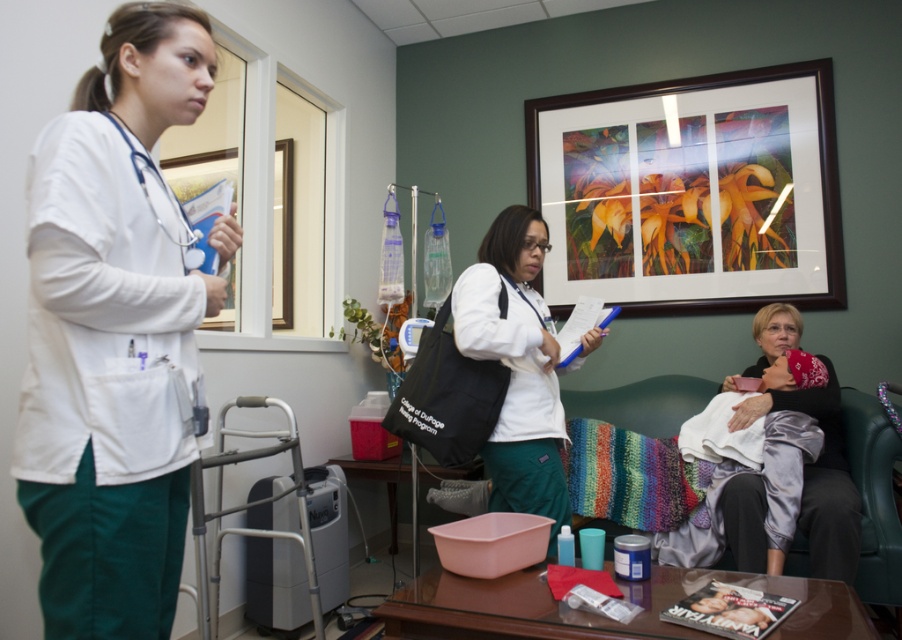
You are a patient in this medical office and need to locate the artwork to admire it while waiting. Which object is positioned higher up in the room between the wooden framed artwork at upper center and the silky satin robe at lower right?

The wooden framed artwork at upper center is positioned higher up in the room compared to the silky satin robe at lower right, so you should look upwards to admire it.

You are a cleaning robot with a width of 2 feet. You are in the medical office and need to move from the silky satin robe at lower right to the white matte stethoscope at left. Can you navigate the space between them?

The distance between the silky satin robe at lower right and the white matte stethoscope at left is 6.91 feet. Since your width is 2 feet, you can navigate the space between them as the distance is sufficient for movement.